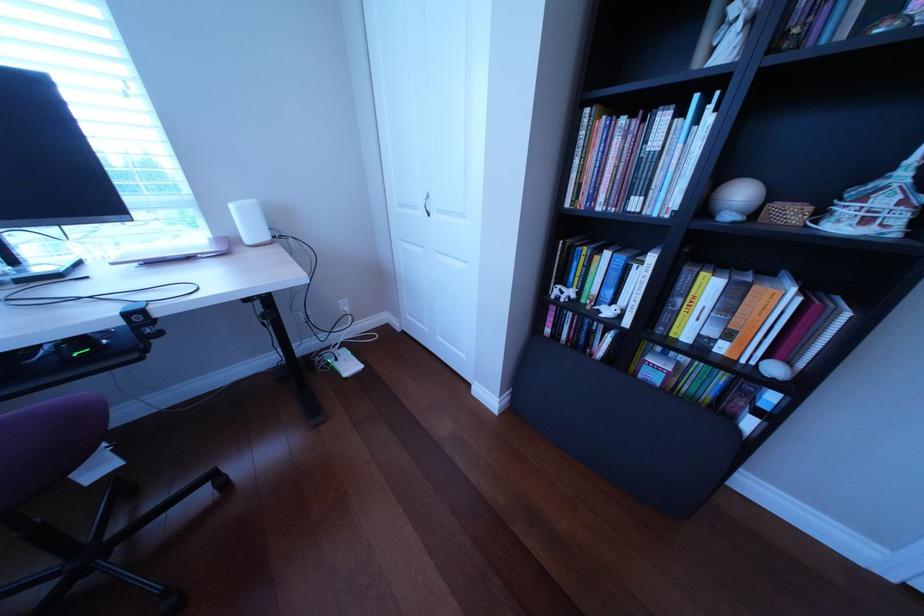
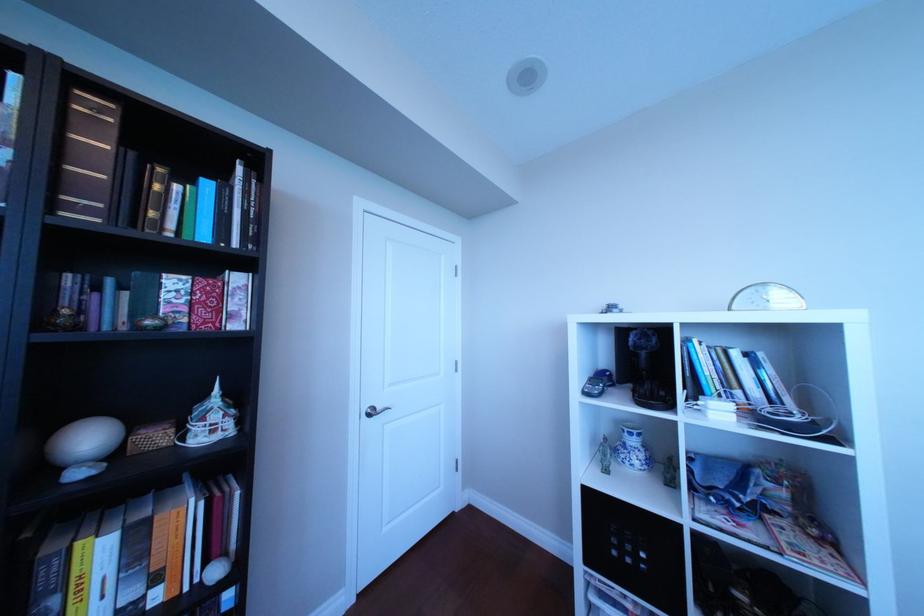
Question: Based on the continuous images, in which direction is the camera rotating? Reply with the corresponding letter.

Choices:
 (A) Left
 (B) Right
 (C) Up
 (D) Down

Answer: (B)